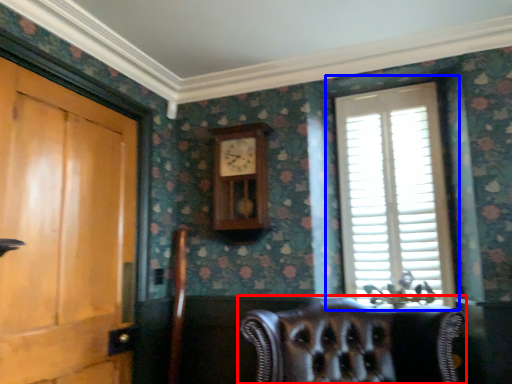
Question: Which point is further to the camera, chair (highlighted by a red box) or window (highlighted by a blue box)?

Choices:
 (A) chair
 (B) window

Answer: (B)